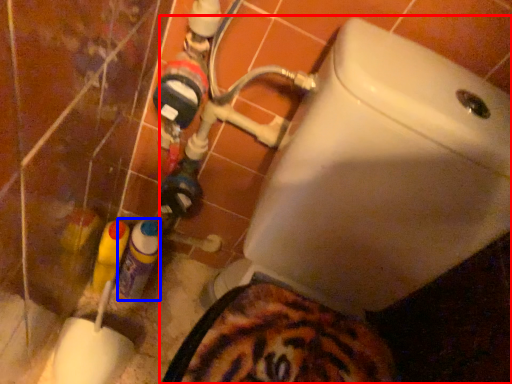
Question: Which object appears closest to the camera in this image, toilet (highlighted by a red box) or bottle (highlighted by a blue box)?

Choices:
 (A) toilet
 (B) bottle

Answer: (A)